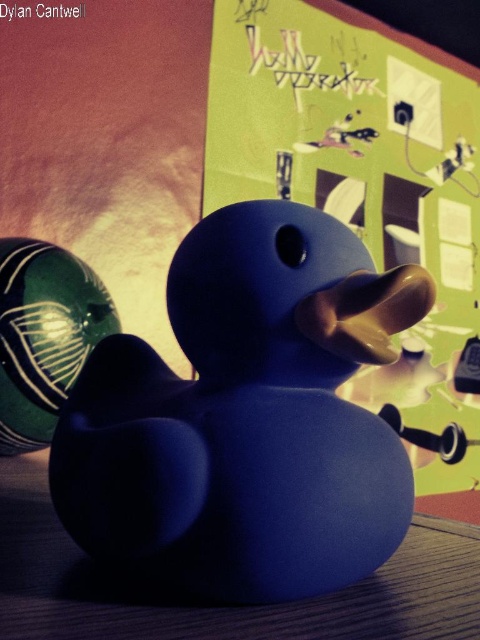
Between matte blue rubber duck at center and matte green bulletin board at center, which one appears on the left side from the viewer's perspective?

Positioned to the left is matte blue rubber duck at center.

Who is more forward, (140, 538) or (440, 244)?

Point (140, 538) is more forward.

Consider the image. Who is more distant from viewer, (384,360) or (432,161)?

The point (432,161) is more distant.

Locate an element on the screen. The height and width of the screenshot is (640, 480). matte blue rubber duck at center is located at coordinates (245, 417).

Who is lower down, wooden table at center or green glossy ball at left?

wooden table at center

Can you confirm if wooden table at center is positioned to the left of green glossy ball at left?

Incorrect, wooden table at center is not on the left side of green glossy ball at left.

Find the location of `wooden table at center`. wooden table at center is located at coordinates tap(220, 605).

Looking at this image, can you confirm if matte blue rubber duck at center is smaller than wooden table at center?

Indeed, matte blue rubber duck at center has a smaller size compared to wooden table at center.

This screenshot has width=480, height=640. What do you see at coordinates (245, 417) in the screenshot?
I see `matte blue rubber duck at center` at bounding box center [245, 417].

The width and height of the screenshot is (480, 640). Identify the location of matte blue rubber duck at center. (245, 417).